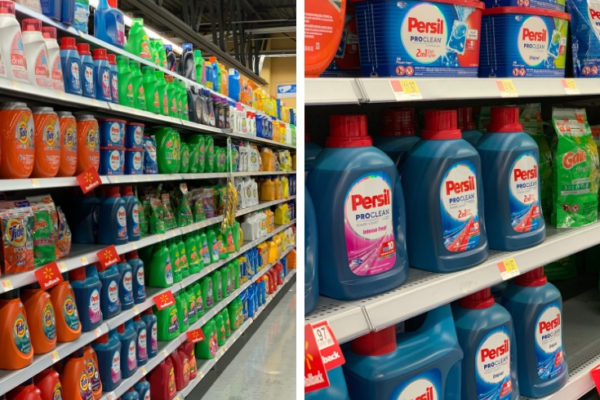
Locate an element on the screen. The width and height of the screenshot is (600, 400). floor is located at coordinates pyautogui.click(x=279, y=360).